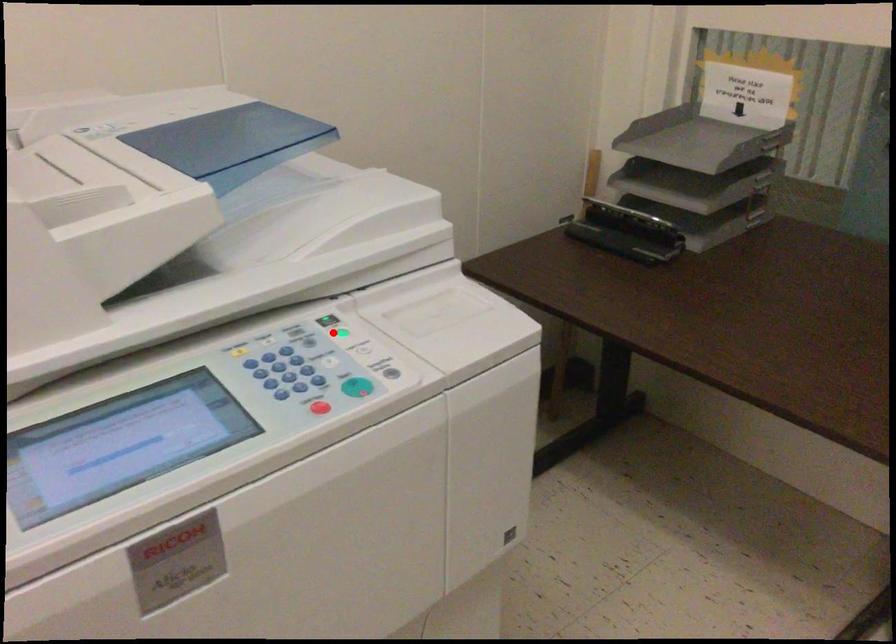
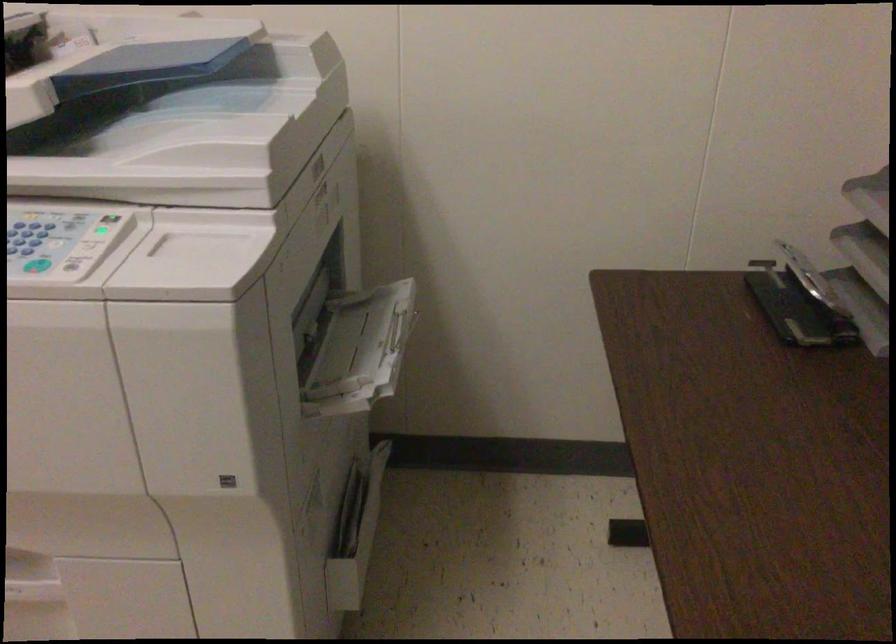
The point at the highlighted location is marked in the first image. Where is the corresponding point in the second image?

(107, 228)